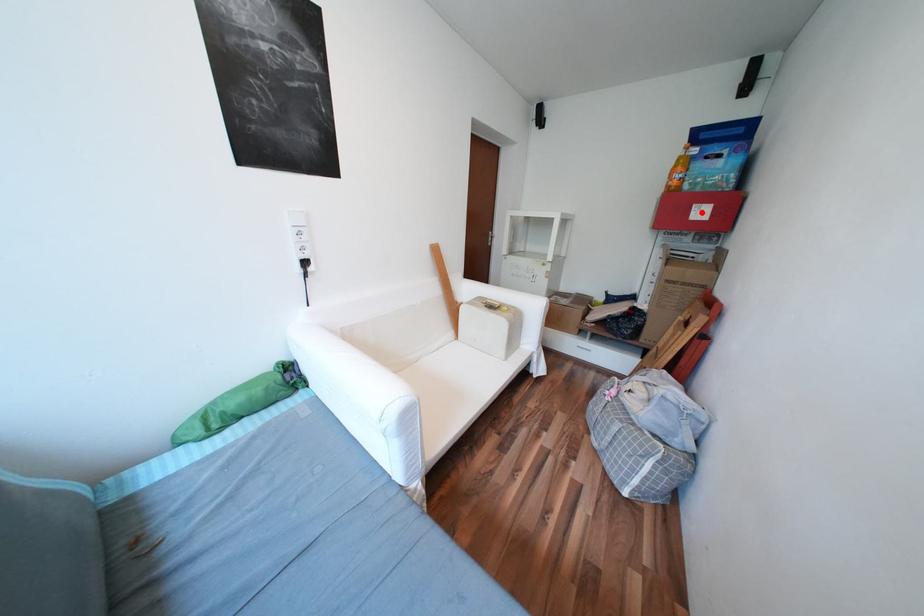
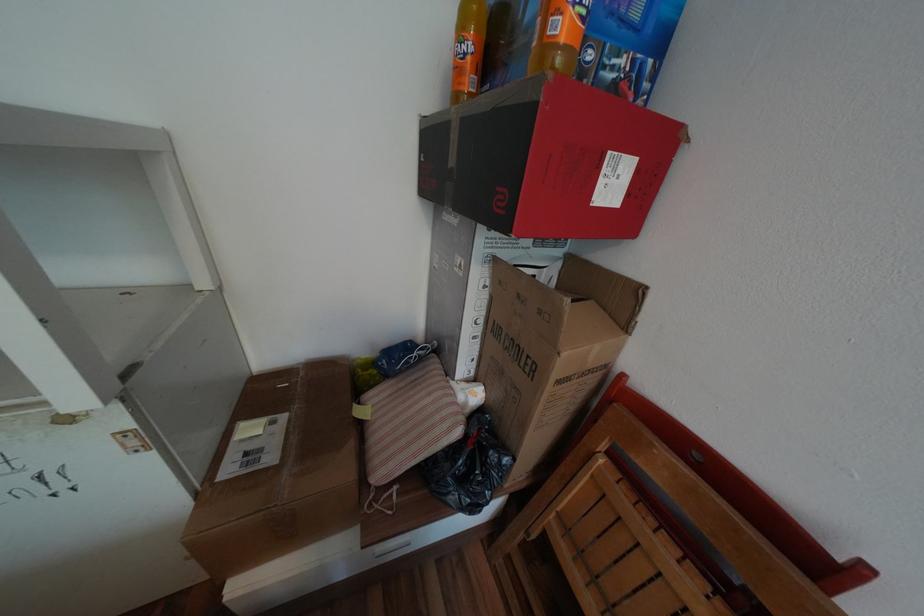
Find the pixel in the second image that matches the highlighted location in the first image.

(611, 182)